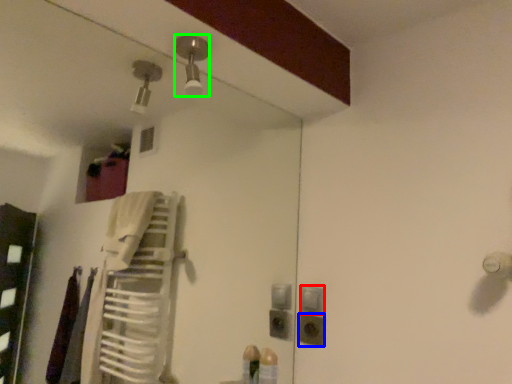
Question: Which is nearer to the light switch (highlighted by a red box)? electric outlet (highlighted by a blue box) or light fixture (highlighted by a green box).

Choices:
 (A) electric outlet
 (B) light fixture

Answer: (A)